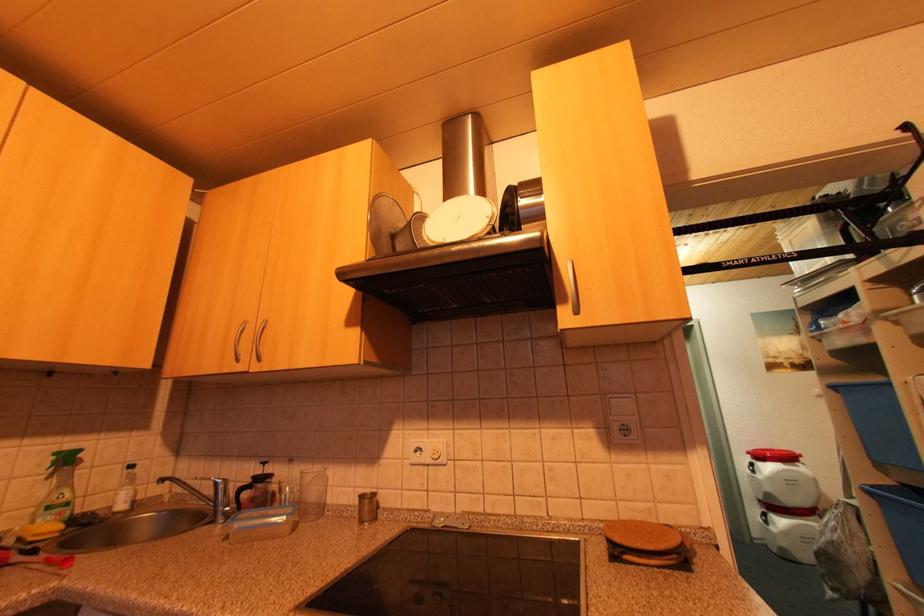
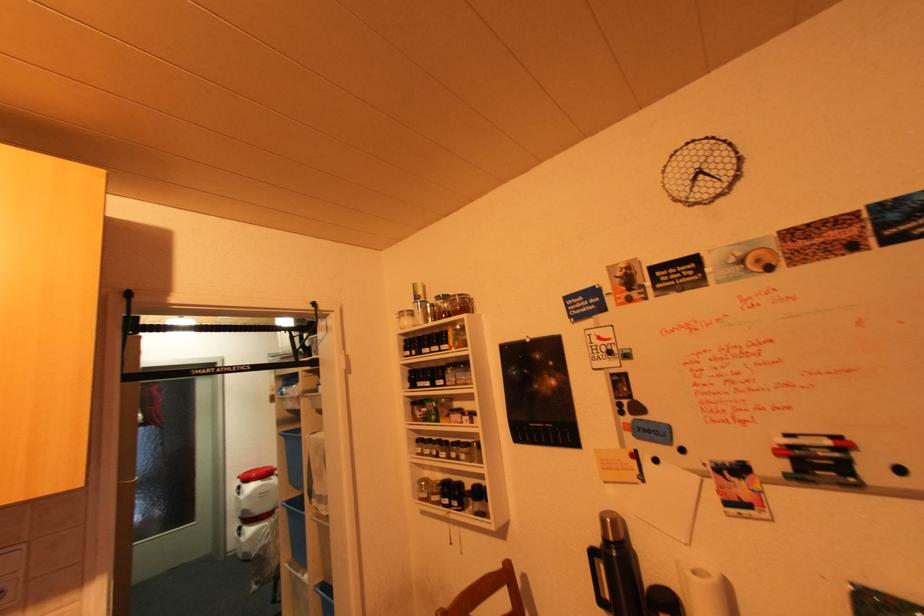
Question: How did the camera likely rotate?

Choices:
 (A) Left
 (B) Right
 (C) Up
 (D) Down

Answer: (B)